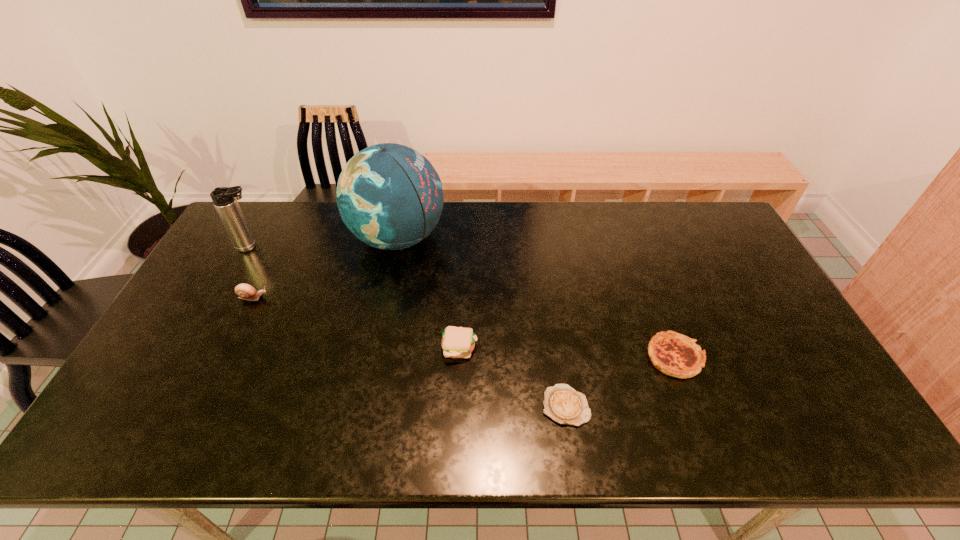
Identify the location of object positioned at the far left corner. (224, 199).

In the image, there is a desktop. Where is `free space at the far edge`? free space at the far edge is located at coordinates (634, 211).

Where is `blank space at the near edge of the desktop`? The height and width of the screenshot is (540, 960). blank space at the near edge of the desktop is located at coordinates (585, 423).

Locate an element on the screen. Image resolution: width=960 pixels, height=540 pixels. blank space at the left edge of the desktop is located at coordinates (191, 316).

Image resolution: width=960 pixels, height=540 pixels. I want to click on free space at the right edge of the desktop, so click(751, 279).

This screenshot has width=960, height=540. Identify the location of free space at the far right corner of the desktop. (726, 233).

Locate an element on the screen. This screenshot has height=540, width=960. vacant area at the near right corner is located at coordinates (803, 435).

The image size is (960, 540). In order to click on vacant point located between the nearer quiche and the fifth tallest object in this screenshot , I will do `click(620, 381)`.

Find the location of `vacant space that's between the tallest object and the thermos bottle`. vacant space that's between the tallest object and the thermos bottle is located at coordinates (324, 242).

Find the location of a particular element. This screenshot has width=960, height=540. vacant space that is in between the farther quiche and the second object from right to left is located at coordinates (620, 381).